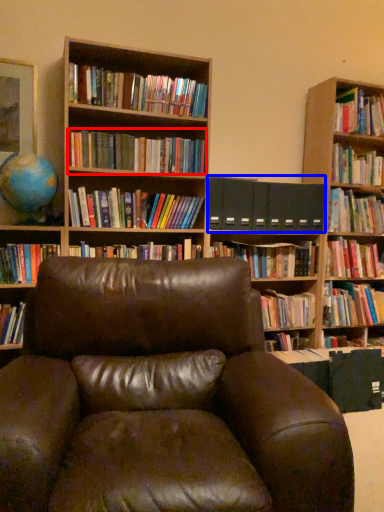
Question: Which point is closer to the camera, book (highlighted by a red box) or paperback book (highlighted by a blue box)?

Choices:
 (A) book
 (B) paperback book

Answer: (A)